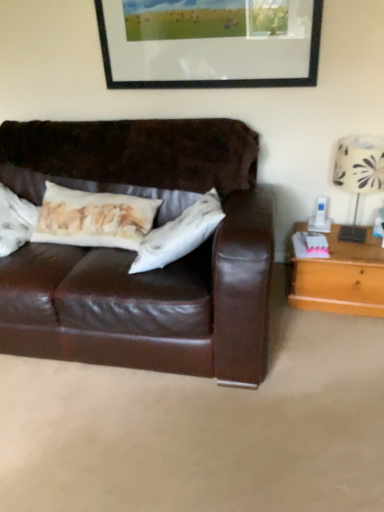
Question: Should I look upward or downward to see light brown wooden table at right?

Choices:
 (A) up
 (B) down

Answer: (B)

Question: Is black matte picture frame at upper center surrounded by light brown wooden table at right?

Choices:
 (A) no
 (B) yes

Answer: (A)

Question: Can you confirm if light brown wooden table at right is smaller than black matte picture frame at upper center?

Choices:
 (A) yes
 (B) no

Answer: (B)

Question: Is light brown wooden table at right aimed at black matte picture frame at upper center?

Choices:
 (A) no
 (B) yes

Answer: (A)

Question: Can you confirm if light brown wooden table at right is taller than black matte picture frame at upper center?

Choices:
 (A) no
 (B) yes

Answer: (A)

Question: Does light brown wooden table at right appear on the right side of black matte picture frame at upper center?

Choices:
 (A) no
 (B) yes

Answer: (B)

Question: From a real-world perspective, is light brown wooden table at right positioned under black matte picture frame at upper center based on gravity?

Choices:
 (A) yes
 (B) no

Answer: (A)

Question: From a real-world perspective, is black matte picture frame at upper center below light brown wooden table at right?

Choices:
 (A) yes
 (B) no

Answer: (B)

Question: Does black matte picture frame at upper center have a larger size compared to light brown wooden table at right?

Choices:
 (A) no
 (B) yes

Answer: (A)

Question: Can you confirm if black matte picture frame at upper center is shorter than light brown wooden table at right?

Choices:
 (A) yes
 (B) no

Answer: (B)

Question: Does black matte picture frame at upper center have a lesser width compared to light brown wooden table at right?

Choices:
 (A) no
 (B) yes

Answer: (B)

Question: Is black matte picture frame at upper center taller than light brown wooden table at right?

Choices:
 (A) yes
 (B) no

Answer: (A)

Question: From the image's perspective, is black matte picture frame at upper center located above light brown wooden table at right?

Choices:
 (A) no
 (B) yes

Answer: (B)

Question: From the image's perspective, is black matte picture frame at upper center under white fabric lampshade at right?

Choices:
 (A) yes
 (B) no

Answer: (B)